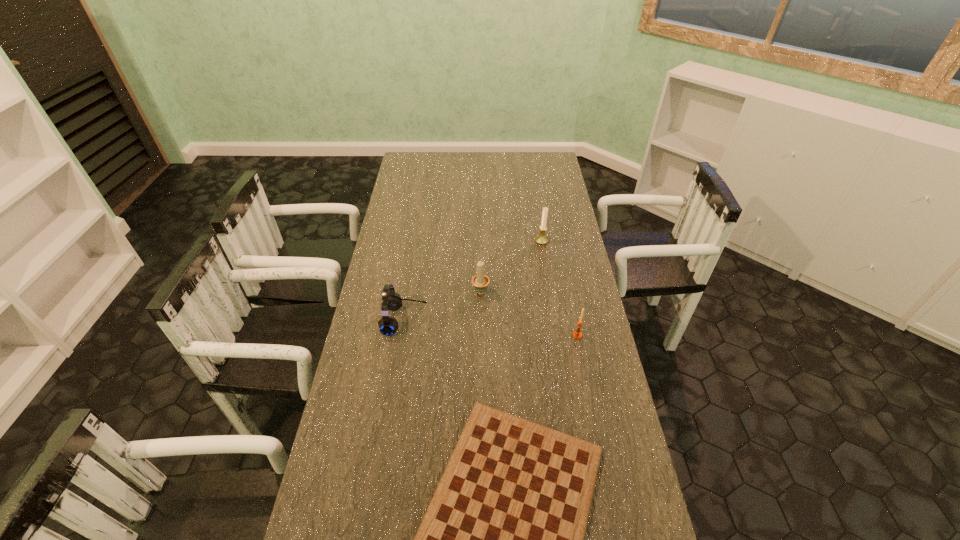
Identify the location of free point between the farthest object and the rightmost candle_holder. The width and height of the screenshot is (960, 540). (560, 288).

Image resolution: width=960 pixels, height=540 pixels. I want to click on blank region between the second candle_holder from left to right and the nearest candle_holder, so click(x=560, y=288).

Where is `free point between the headset and the rightmost candle_holder`? free point between the headset and the rightmost candle_holder is located at coordinates (491, 328).

Point out which object is positioned as the nearest to the nearest candle_holder. Please provide its 2D coordinates. Your answer should be formatted as a tuple, i.e. [(x, y)], where the tuple contains the x and y coordinates of a point satisfying the conditions above.

[(503, 537)]

You are a GUI agent. You are given a task and a screenshot of the screen. Output one action in this format:
    pyautogui.click(x=<x>, y=<y>)
    Task: Click on the object that is the second closest to the leftmost candle_holder
    The height and width of the screenshot is (540, 960).
    Given the screenshot: What is the action you would take?
    pyautogui.click(x=541, y=239)

I want to click on candle_holder that is the second nearest to the nearest object, so click(x=480, y=281).

Choose which candle_holder is the third nearest neighbor to the gameboard. Please provide its 2D coordinates. Your answer should be formatted as a tuple, i.e. [(x, y)], where the tuple contains the x and y coordinates of a point satisfying the conditions above.

[(541, 239)]